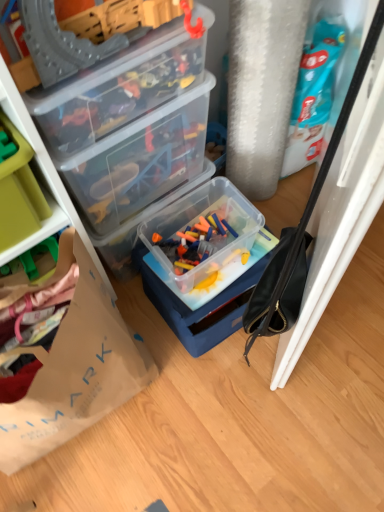
Find the location of a particular element. The image size is (384, 512). empty space that is in between brown paper bag at lower left and translucent plastic container at center, the 3th box in the top-to-bottom sequence is located at coordinates (158, 360).